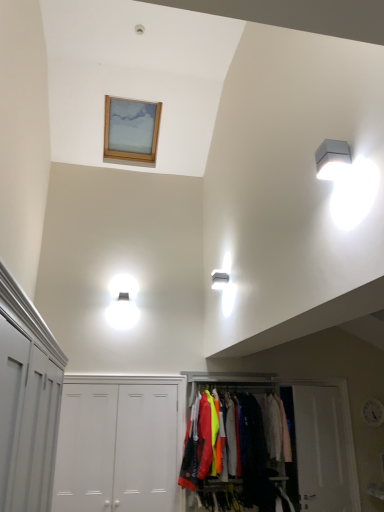
Question: Is white matte door at center, which ranks as the first door in left-to-right order, in contact with white plastic light fixture at upper right?

Choices:
 (A) no
 (B) yes

Answer: (A)

Question: Is white matte door at center, which ranks as the first door in left-to-right order, outside white plastic light fixture at upper right?

Choices:
 (A) yes
 (B) no

Answer: (A)

Question: Can you confirm if white matte door at center, which ranks as the first door in left-to-right order, is wider than white plastic light fixture at upper right?

Choices:
 (A) no
 (B) yes

Answer: (A)

Question: Considering the relative positions of white matte door at center, which ranks as the first door in left-to-right order, and white plastic light fixture at upper right in the image provided, is white matte door at center, which ranks as the first door in left-to-right order, to the left of white plastic light fixture at upper right from the viewer's perspective?

Choices:
 (A) yes
 (B) no

Answer: (A)

Question: Is white matte door at center, the 4th door in the right-to-left sequence, positioned with its back to white plastic light fixture at upper right?

Choices:
 (A) no
 (B) yes

Answer: (A)

Question: From a real-world perspective, is white matte door at center, the 4th door in the right-to-left sequence, below white plastic light fixture at upper right?

Choices:
 (A) no
 (B) yes

Answer: (B)

Question: Can you confirm if white painted wood cabinet at left is bigger than matte fabric clothes rack at center?

Choices:
 (A) no
 (B) yes

Answer: (B)

Question: Can you confirm if white painted wood cabinet at left is taller than matte fabric clothes rack at center?

Choices:
 (A) yes
 (B) no

Answer: (B)

Question: Does white painted wood cabinet at left come behind matte fabric clothes rack at center?

Choices:
 (A) yes
 (B) no

Answer: (B)

Question: Considering the relative sizes of white painted wood cabinet at left and matte fabric clothes rack at center in the image provided, is white painted wood cabinet at left smaller than matte fabric clothes rack at center?

Choices:
 (A) yes
 (B) no

Answer: (B)

Question: From the image's perspective, is white painted wood cabinet at left below matte fabric clothes rack at center?

Choices:
 (A) no
 (B) yes

Answer: (A)

Question: Does white painted wood cabinet at left have a lesser width compared to matte fabric clothes rack at center?

Choices:
 (A) no
 (B) yes

Answer: (A)

Question: From the image's perspective, is matte fabric clothes rack at center over light pink fabric at center?

Choices:
 (A) no
 (B) yes

Answer: (A)